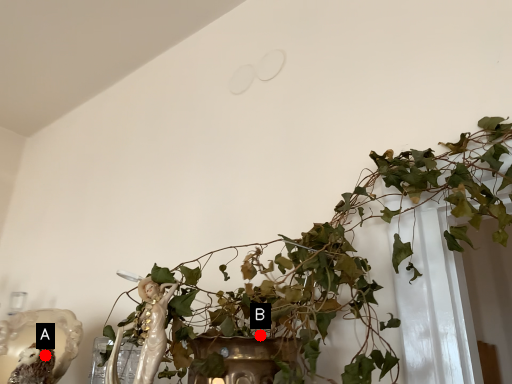
Question: Two points are circled on the image, labeled by A and B beside each circle. Which of the following is the farthest from the observer?

Choices:
 (A) A is further
 (B) B is further

Answer: (A)